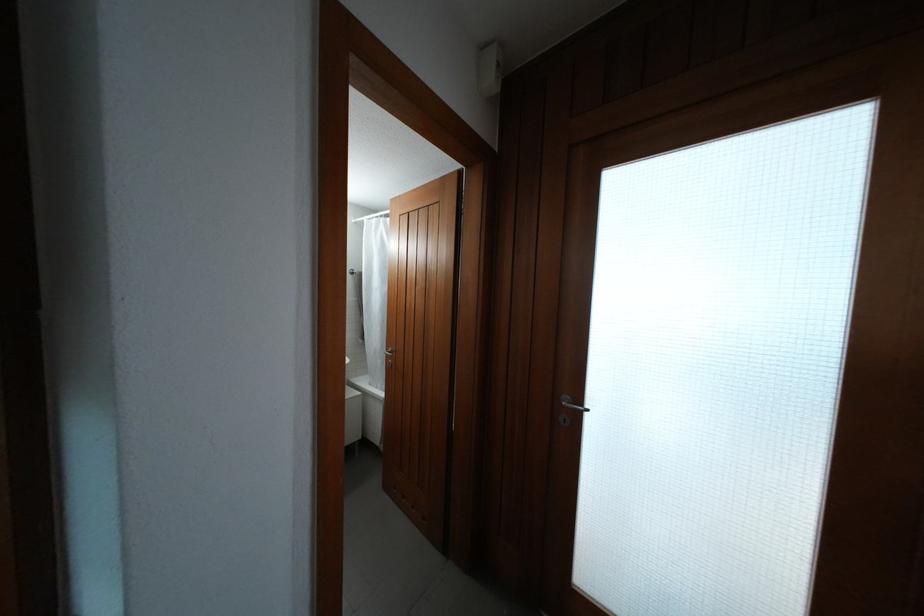
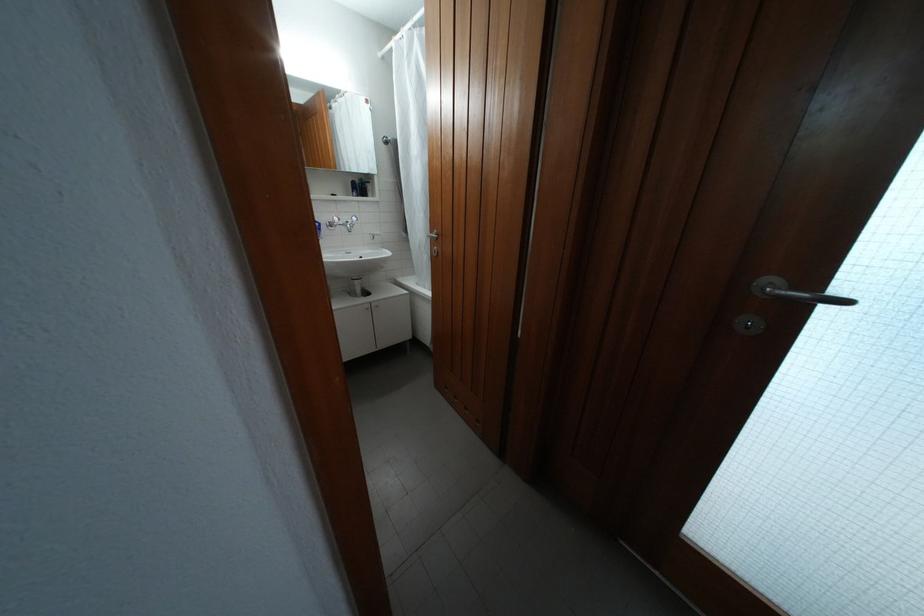
Where in the second image is the point corresponding to point 578,408 from the first image?

(791, 294)